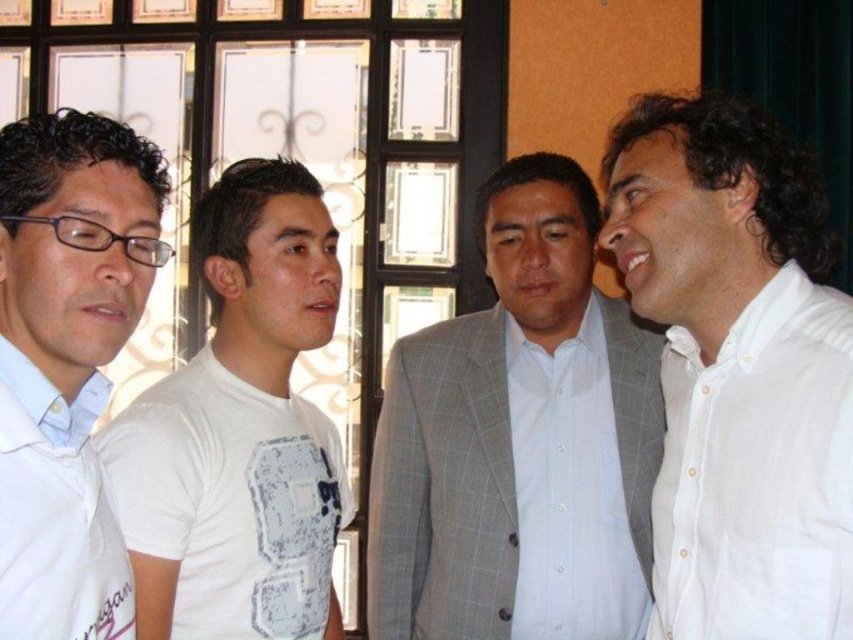
In the scene shown: You are organizing a photo shoot and need to arrange the white cotton shirt at right and the white shirt at left on a table. Based on the image, which shirt should you place on the left side of the table to ensure they are arranged in order from widest to narrowest?

The white cotton shirt at right is wider than the white shirt at left, so you should place the white shirt at left on the left side of the table to have them arranged from widest to narrowest.